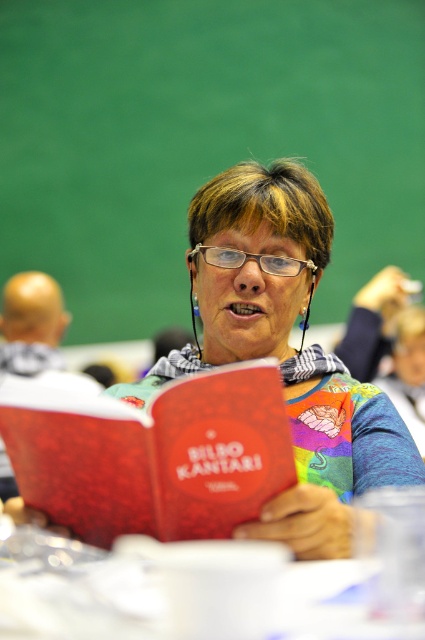
You are standing in the conference room and want to point to the nearest point between point (291, 276) and point (223, 253). Which point should you point to?

Point (223, 253) is closer to you than point (291, 276), so you should point to point (223, 253).

You are organizing a small display and need to place the matte red book at center and transparent plastic glasses at center on a shelf. Which object should you place first if you want to ensure they both fit without rearranging?

The matte red book at center should be placed first because it might be wider than the transparent plastic glasses at center, so placing the wider item first ensures both can fit without needing to rearrange.